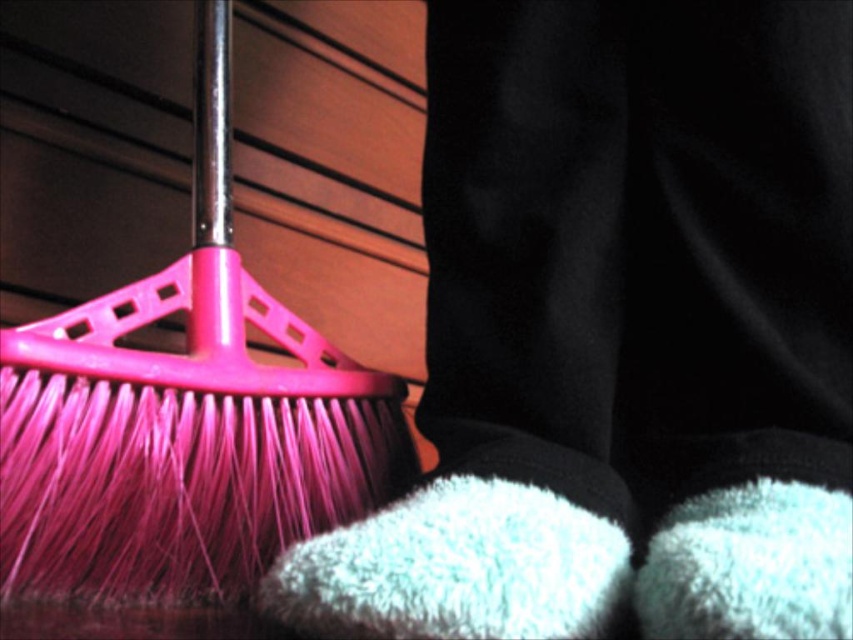
From the picture: You are standing in the scene and want to pick up the pink plastic brush at left. Based on its 2D location coordinates, where exactly should you look to find it?

The pink plastic brush at left is located at the 2D coordinates point (184, 417), so you should look there to find it.

You are a robot trying to pick up the fuzzy white sock at lower center. The pink plastic brush at left is in your way. Can you move the brush to the side to reach the sock?

The pink plastic brush at left is much taller than the fuzzy white sock at lower center, so you can move the brush to the side to reach the sock.

You are a cleaning robot and need to determine the best path to avoid obstacles. You see a pink plastic brush at left and a fuzzy white sock at lower center. Which object is wider, and should you navigate around it more carefully?

The pink plastic brush at left is wider than the fuzzy white sock at lower center. You should navigate around the pink plastic brush at left more carefully due to its greater width.